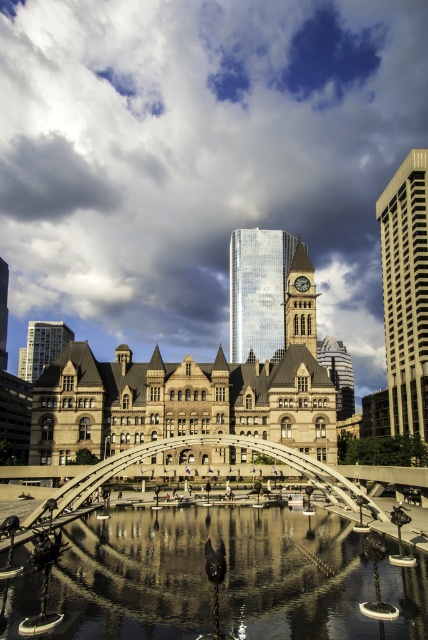
You are a tourist standing in front of the historic building and want to take a photo that includes both the beige concrete skyscraper at right and the metallic arched bridge at center. Based on their positions, which object should you place on the right side of your photo to capture both in the frame?

The beige concrete skyscraper at right is positioned on the right side of the metallic arched bridge at center, so to include both in your photo, you should place the beige concrete skyscraper at right on the right side of the frame and the metallic arched bridge at center in the center.